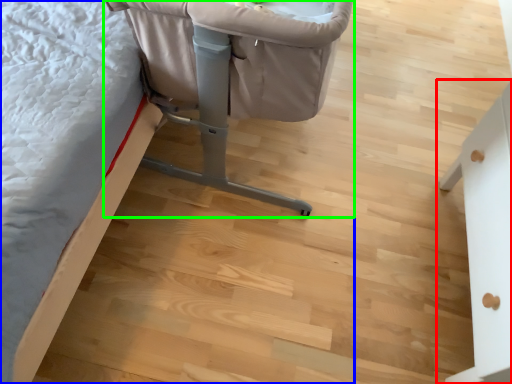
Question: Which is nearer to the furniture (highlighted by a red box)? furniture (highlighted by a blue box) or furniture (highlighted by a green box).

Choices:
 (A) furniture
 (B) furniture

Answer: (B)